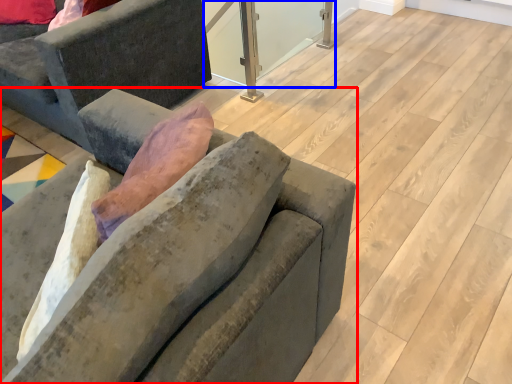
Question: Which of the following is the closest to the observer, studio couch (highlighted by a red box) or window screen (highlighted by a blue box)?

Choices:
 (A) studio couch
 (B) window screen

Answer: (A)